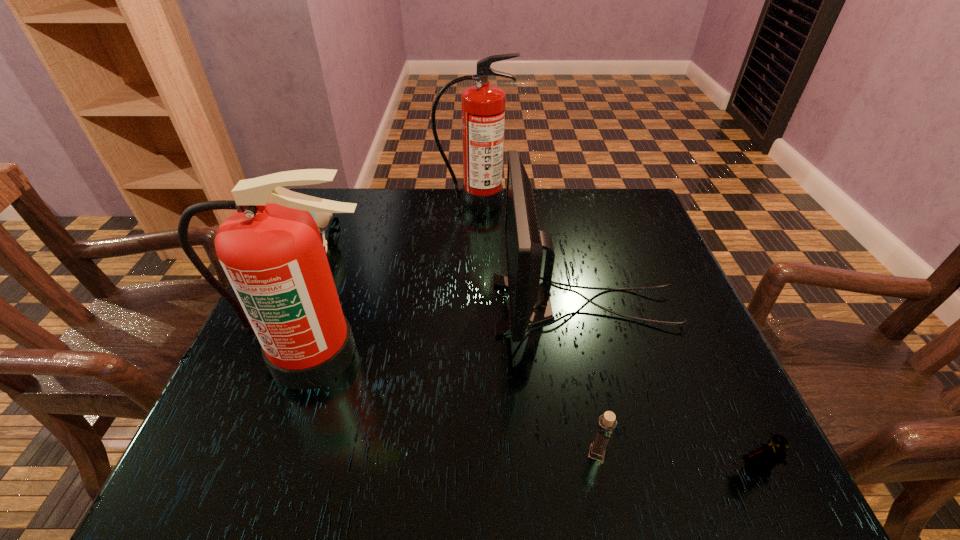
Where is `object identified as the third closest to the fourth tallest object`? The image size is (960, 540). object identified as the third closest to the fourth tallest object is located at coordinates [x=530, y=305].

Identify the location of free space that satisfies the following two spatial constraints: 1. on the screen side of the computer monitor; 2. at the nozzle of the left fire extinguisher. The height and width of the screenshot is (540, 960). (597, 355).

At what (x,y) coordinates should I click in order to perform the action: click on vacant space that satisfies the following two spatial constraints: 1. on the screen side of the computer monitor; 2. at the nozzle of the left fire extinguisher. Please return your answer as a coordinate pair (x, y). Looking at the image, I should click on (597, 355).

This screenshot has width=960, height=540. I want to click on free point that satisfies the following two spatial constraints: 1. on the screen side of the fourth shortest object; 2. on the front side of the candle holder, so click(621, 454).

Find the location of a particular element. free space that satisfies the following two spatial constraints: 1. at the nozzle of the left fire extinguisher; 2. on the left side of the fifth tallest object is located at coordinates (280, 454).

The width and height of the screenshot is (960, 540). In order to click on free spot that satisfies the following two spatial constraints: 1. on the front-facing side of the farthest object; 2. on the left side of the fifth tallest object in this screenshot , I will do `click(470, 454)`.

The width and height of the screenshot is (960, 540). What are the coordinates of `vacant position in the image that satisfies the following two spatial constraints: 1. at the nozzle of the left fire extinguisher; 2. on the left side of the candle holder` in the screenshot? It's located at (280, 454).